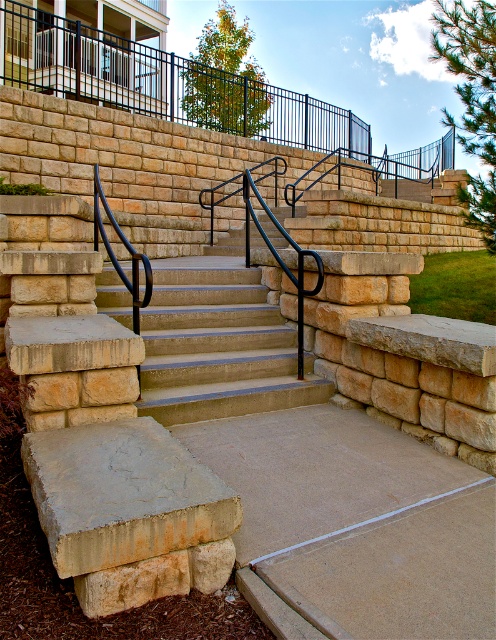
You are a maintenance worker needing to inspect both the black metal railing at upper center and the smooth stone stairs at center. Starting from the bottom of the stairs, which object should you reach first as you climb upwards?

The smooth stone stairs at center will be reached first as you climb upwards since the black metal railing at upper center is positioned above them.